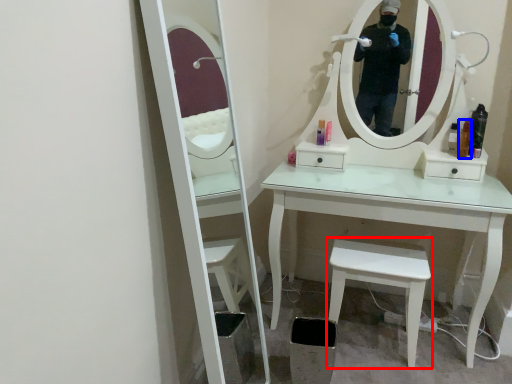
Question: Which point is closer to the camera, stool (highlighted by a red box) or toiletry (highlighted by a blue box)?

Choices:
 (A) stool
 (B) toiletry

Answer: (A)